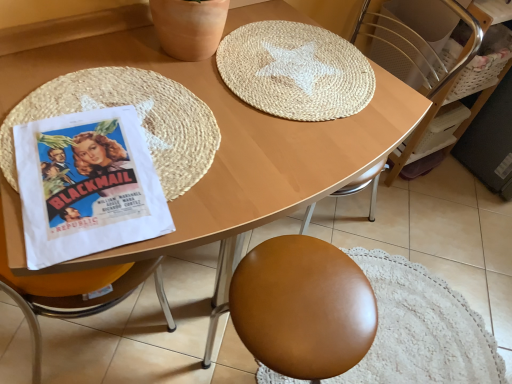
You are a GUI agent. You are given a task and a screenshot of the screen. Output one action in this format:
    pyautogui.click(x=<x>, y=<y>)
    Task: Click on the free point behind white paper poster at left
    This screenshot has width=512, height=384.
    Given the screenshot: What is the action you would take?
    pyautogui.click(x=169, y=86)